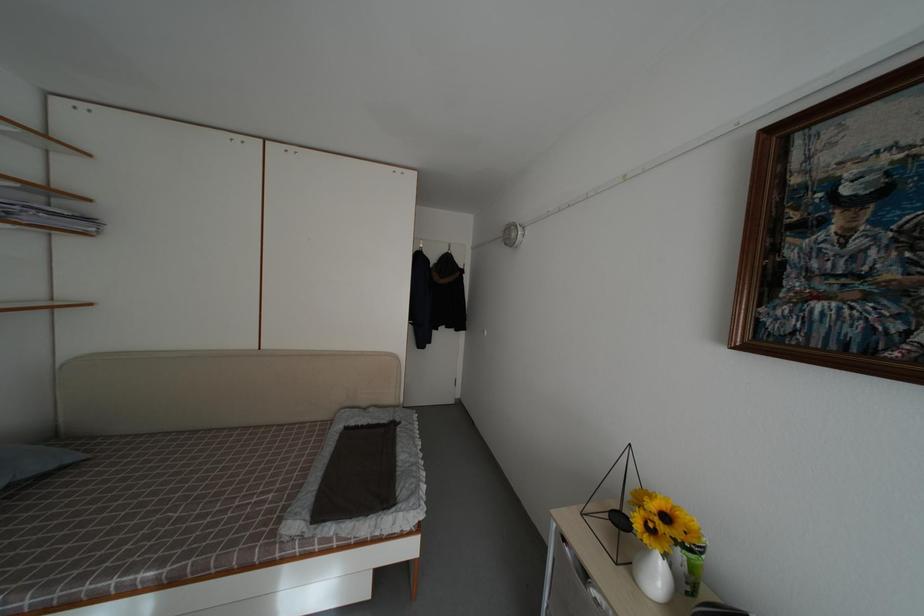
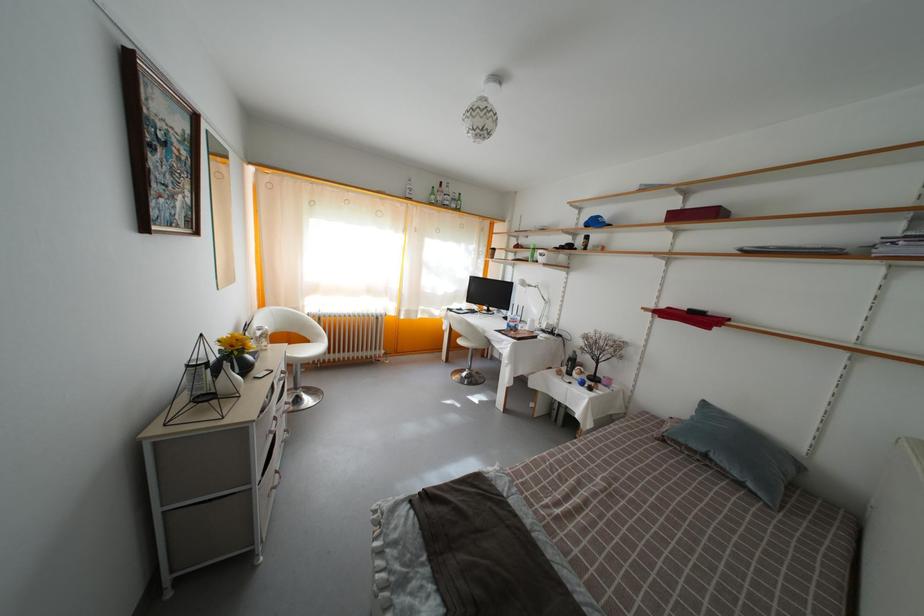
Find the pixel in the second image that matches pixel 57 474 in the first image.

(743, 482)